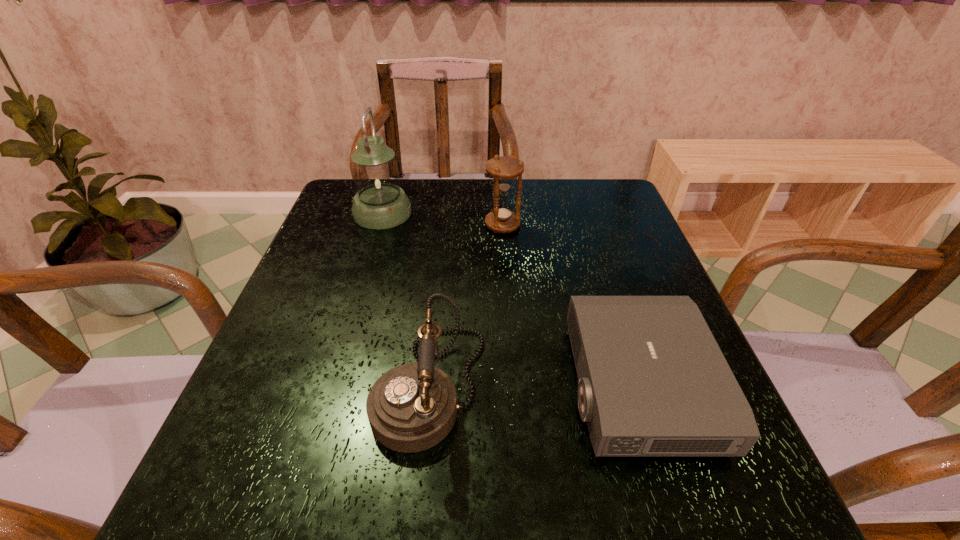
Locate an element on the screen. empty space between the second object from left to right and the lantern is located at coordinates (406, 300).

Find the location of a particular element. This screenshot has height=540, width=960. vacant space that is in between the projector and the leftmost object is located at coordinates (511, 299).

Find the location of a particular element. The height and width of the screenshot is (540, 960). free spot between the hourglass and the third tallest object is located at coordinates (467, 306).

The image size is (960, 540). What are the coordinates of `unoccupied position between the lantern and the second tallest object` in the screenshot? It's located at (443, 219).

At what (x,y) coordinates should I click in order to perform the action: click on free area in between the tallest object and the third shortest object. Please return your answer as a coordinate pair (x, y). The image size is (960, 540). Looking at the image, I should click on (443, 219).

The height and width of the screenshot is (540, 960). Identify the location of vacant point located between the projector and the second object from left to right. (534, 386).

Identify which object is the nearest to the lantern. Please provide its 2D coordinates. Your answer should be formatted as a tuple, i.e. [(x, y)], where the tuple contains the x and y coordinates of a point satisfying the conditions above.

[(504, 169)]

Identify which object is the second nearest to the third shortest object. Please provide its 2D coordinates. Your answer should be formatted as a tuple, i.e. [(x, y)], where the tuple contains the x and y coordinates of a point satisfying the conditions above.

[(653, 381)]

At what (x,y) coordinates should I click in order to perform the action: click on vacant region that satisfies the following two spatial constraints: 1. on the front side of the hourglass; 2. on the right side of the leftmost object. Please return your answer as a coordinate pair (x, y). Looking at the image, I should click on (379, 225).